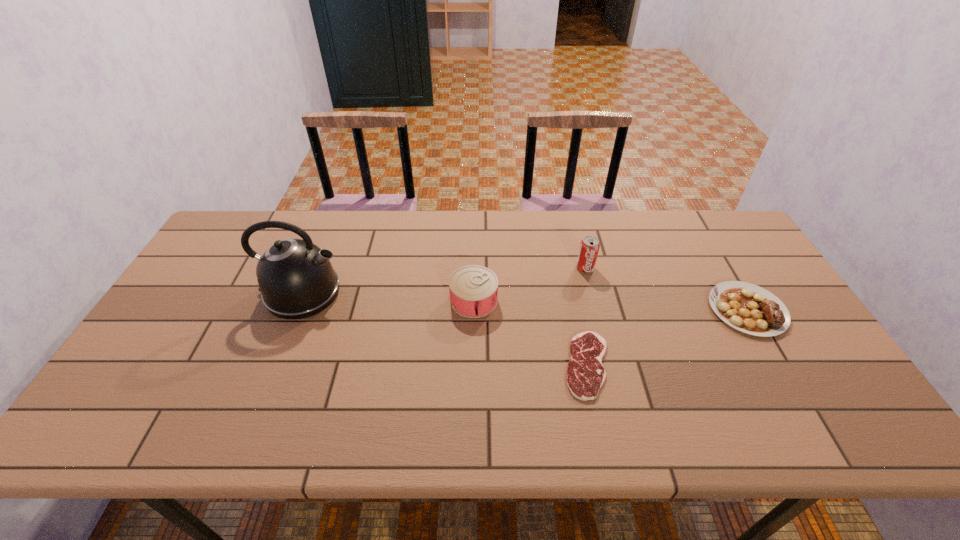
Locate an element on the screen. vacant space that satisfies the following two spatial constraints: 1. on the front side of the soda can; 2. on the spout of the kettle is located at coordinates (591, 293).